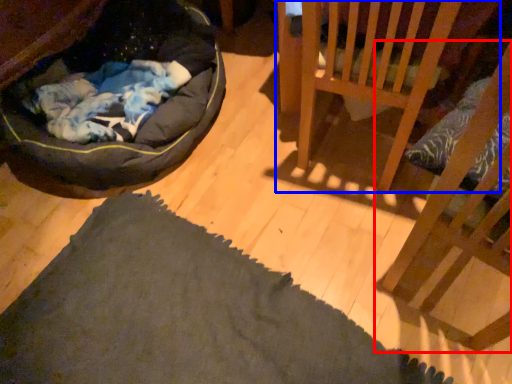
Question: Which object is closer to the camera taking this photo, furniture (highlighted by a red box) or furniture (highlighted by a blue box)?

Choices:
 (A) furniture
 (B) furniture

Answer: (A)